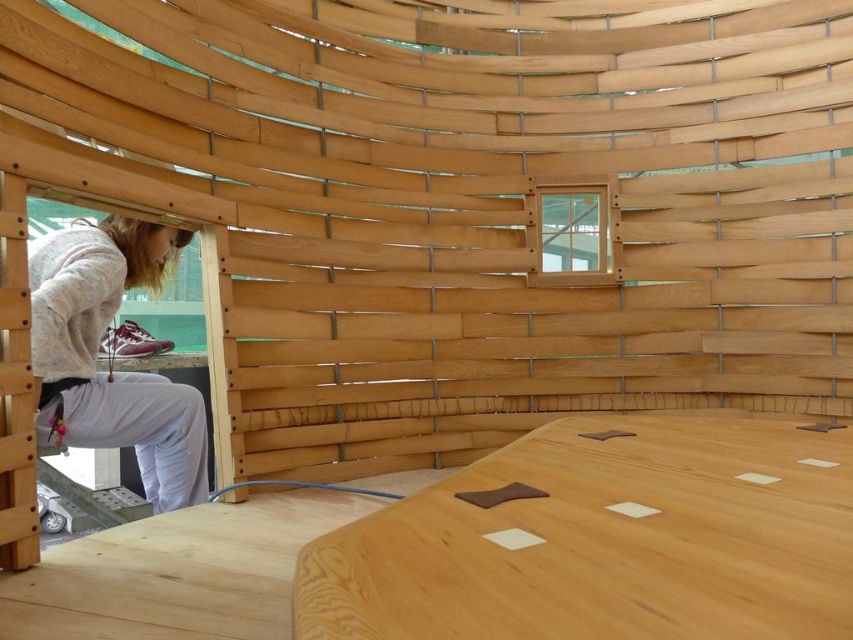
You are planning to place the light gray sweater at lower left on the natural wood table at center. Will it fit entirely on the table?

The natural wood table at center is wider than the light gray sweater at lower left, so yes, the sweater will fit entirely on the table.

You are standing in the circular wooden structure and want to place a book on the natural wood table at center. To do so, you need to walk from the light gray sweater at lower left. In which direction should you move relative to your current position?

You should move to the right relative to your current position because the natural wood table at center is to the right of the light gray sweater at lower left.

You are organizing a small gathering in this circular wooden structure. You have a light gray sweater at lower left that you want to place on the natural wood table at center. Will the sweater fit on the table?

The natural wood table at center is smaller than the light gray sweater at lower left, so the sweater will not fit on the table.